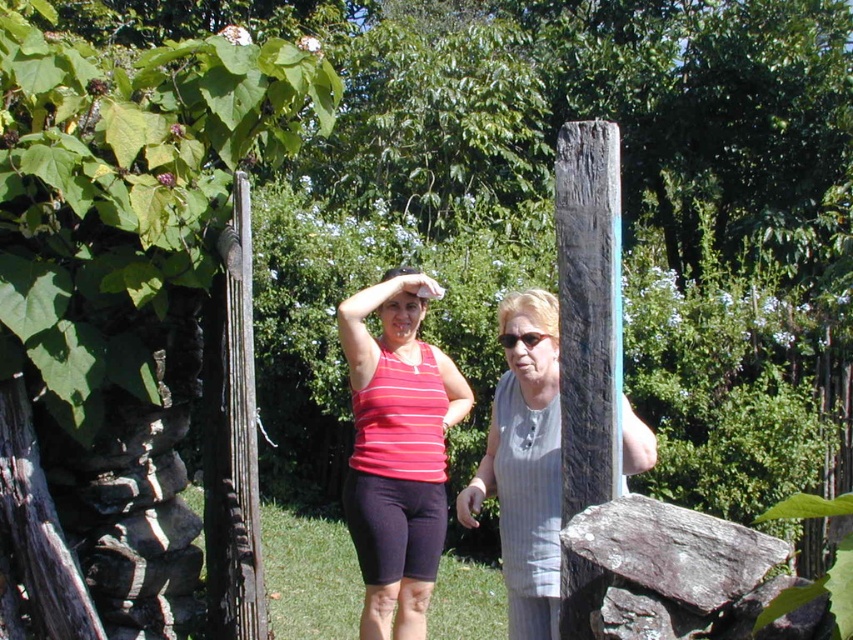
Does point (440, 365) come in front of point (508, 346)?

No, it is not.

Can you confirm if matte red tank top at center is wider than matte black sunglasses at center?

Indeed, matte red tank top at center has a greater width compared to matte black sunglasses at center.

Measure the distance between point [434,516] and camera.

4.09 meters

Identify the location of matte red tank top at center. The image size is (853, 640). (397, 451).

Is matte red tank top at center below weathered wood post at left?

Correct, matte red tank top at center is located below weathered wood post at left.

Is point (399, 602) farther from camera compared to point (213, 385)?

Yes, point (399, 602) is farther from viewer.

The image size is (853, 640). Describe the element at coordinates (397, 451) in the screenshot. I see `matte red tank top at center` at that location.

At what (x,y) coordinates should I click in order to perform the action: click on matte red tank top at center. Please return your answer as a coordinate pair (x, y). Looking at the image, I should click on (397, 451).

Is weathered wood post at right further to camera compared to weathered wood post at left?

No, weathered wood post at right is closer to the viewer.

Based on the photo, which of these two, weathered wood post at right or weathered wood post at left, stands shorter?

weathered wood post at right

This screenshot has height=640, width=853. Identify the location of weathered wood post at right. (589, 308).

This screenshot has width=853, height=640. Identify the location of weathered wood post at right. (589, 308).